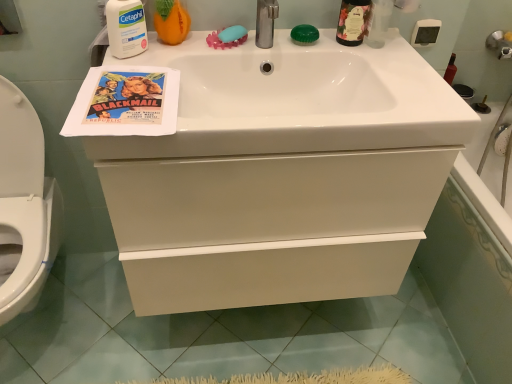
Identify the location of vacant space that is in between green glossy soap at upper center, the 2th soap from the left, and blue rubber soap at upper center, the 1th soap viewed from the left. (266, 41).